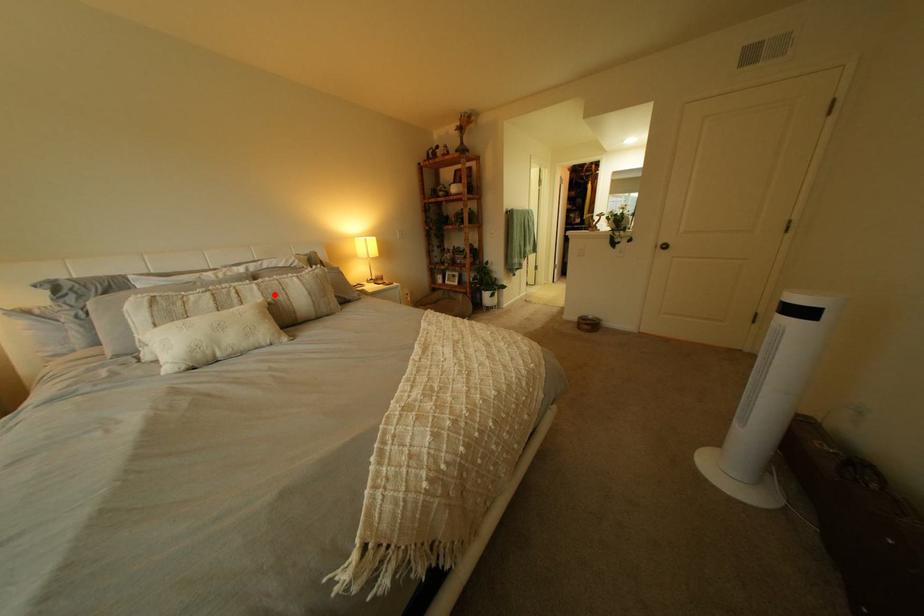
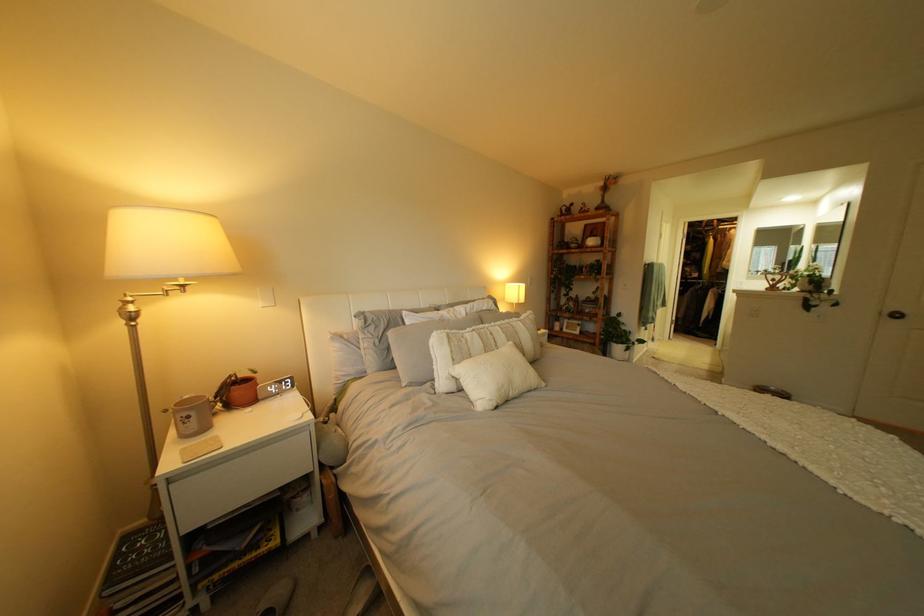
Question: I am providing you with two images of the same scene from different viewpoints. Image1 has a red point marked. In image2, the corresponding 3D location appears at what relative position? Reply with the corresponding letter.

Choices:
 (A) Closer
 (B) Farther

Answer: (B)